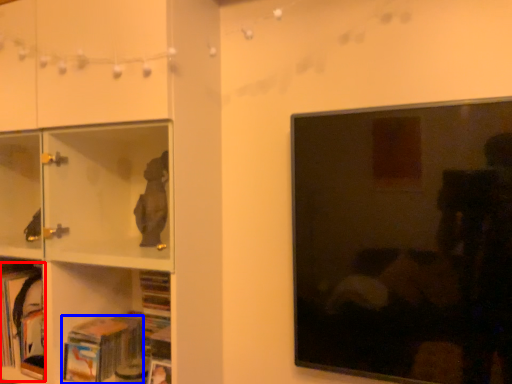
Question: Which point is closer to the camera, book (highlighted by a red box) or book (highlighted by a blue box)?

Choices:
 (A) book
 (B) book

Answer: (B)